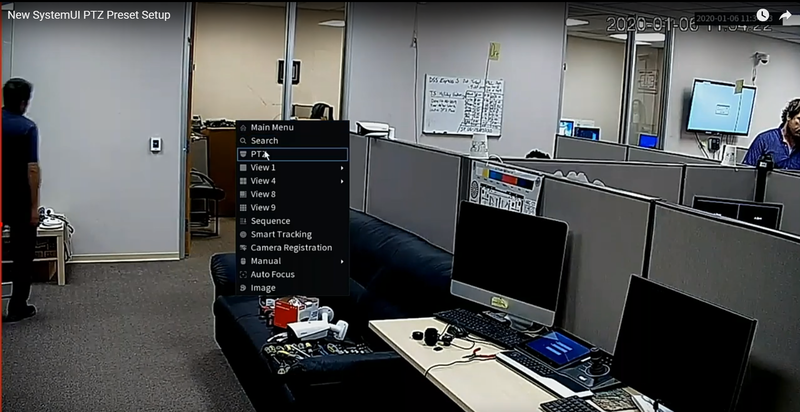
Locate an element on the screen. This screenshot has height=412, width=800. whiteboard is located at coordinates (449, 104).